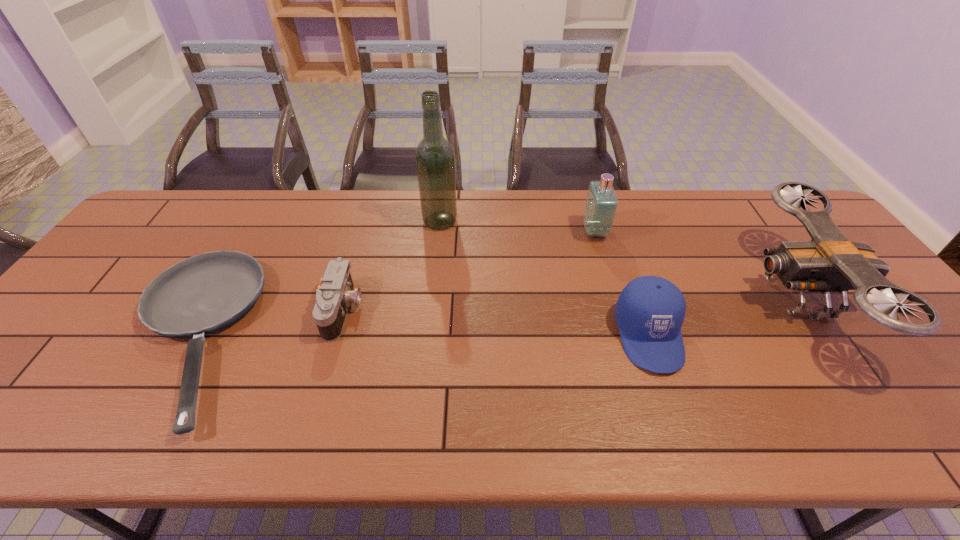
You are a GUI agent. You are given a task and a screenshot of the screen. Output one action in this format:
    pyautogui.click(x=<x>, y=<y>)
    Task: Click on the third object from left to right
    
    Given the screenshot: What is the action you would take?
    pyautogui.click(x=435, y=162)

The image size is (960, 540). What are the coordinates of `liquor` in the screenshot? It's located at (435, 162).

At what (x,y) coordinates should I click in order to perform the action: click on drone. Please return your answer as a coordinate pair (x, y). The width and height of the screenshot is (960, 540). Looking at the image, I should click on (830, 262).

Where is `perfume`? This screenshot has width=960, height=540. perfume is located at coordinates (601, 205).

Find the location of `cap`. cap is located at coordinates (650, 311).

The height and width of the screenshot is (540, 960). In order to click on the second shortest object in this screenshot , I will do `click(333, 298)`.

You are a GUI agent. You are given a task and a screenshot of the screen. Output one action in this format:
    pyautogui.click(x=<x>, y=<y>)
    Task: Click on the fifth object from right to left
    This screenshot has height=540, width=960.
    Given the screenshot: What is the action you would take?
    pyautogui.click(x=333, y=298)

Locate an element on the screen. the shortest object is located at coordinates (202, 294).

Where is `frying pan`? frying pan is located at coordinates (202, 294).

This screenshot has width=960, height=540. I want to click on vacant space located 0.290m on the left of the fourth object from right to left, so click(330, 221).